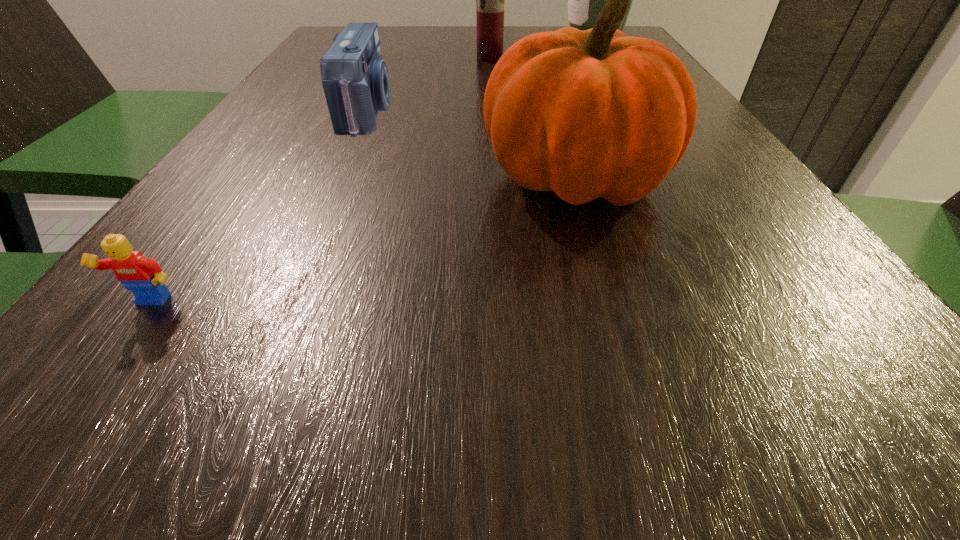
This screenshot has height=540, width=960. I want to click on vacant position located 0.160m on the front-facing side of the farther liquor, so click(502, 42).

Where is `free space located on the front-facing side of the farther liquor`? Image resolution: width=960 pixels, height=540 pixels. free space located on the front-facing side of the farther liquor is located at coordinates (444, 42).

The image size is (960, 540). I want to click on blank space located on the label of the nearer liquor, so click(492, 89).

This screenshot has height=540, width=960. I want to click on vacant space located 0.190m on the back of the third tallest object, so click(550, 93).

You are a GUI agent. You are given a task and a screenshot of the screen. Output one action in this format:
    pyautogui.click(x=<x>, y=<y>)
    Task: Click on the vacant area situated 0.220m on the lens of the camera
    The width and height of the screenshot is (960, 540).
    Given the screenshot: What is the action you would take?
    pyautogui.click(x=505, y=111)

Find the location of a particular element. vacant space located 0.150m on the face of the leftmost object is located at coordinates (43, 454).

Where is `camera at the left edge`? camera at the left edge is located at coordinates (355, 79).

The image size is (960, 540). In order to click on Lego that is at the left edge in this screenshot , I will do `click(142, 276)`.

Where is `liquor that is at the right edge`? liquor that is at the right edge is located at coordinates (585, 0).

Find the location of a particular element. This screenshot has width=960, height=540. pumpkin that is positioned at the right edge is located at coordinates (586, 114).